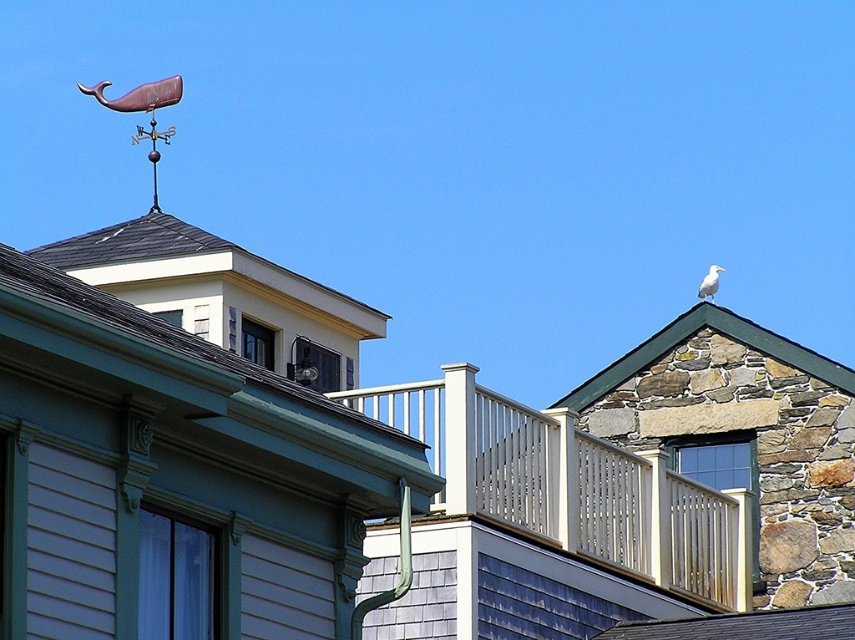
Question: Which of the following is the farthest from the observer?

Choices:
 (A) (96, 266)
 (B) (749, 340)
 (C) (96, 300)
 (D) (771, 618)

Answer: (B)

Question: Can you confirm if stone at upper right is positioned above shiny black shingles at upper center?

Choices:
 (A) yes
 (B) no

Answer: (A)

Question: Which object is farther from the camera taking this photo?

Choices:
 (A) shiny black shingles at upper center
 (B) white feathered bird at upper right

Answer: (B)

Question: Is green shingles at upper center bigger than white feathered bird at upper right?

Choices:
 (A) no
 (B) yes

Answer: (A)

Question: Which object is farther from the camera taking this photo?

Choices:
 (A) white shingles at upper center
 (B) green shingles at upper center
 (C) stone at upper right
 (D) shiny black shingles at upper center

Answer: (C)

Question: Can you confirm if white shingles at upper center is positioned below rusty metal whale at upper left?

Choices:
 (A) no
 (B) yes

Answer: (B)